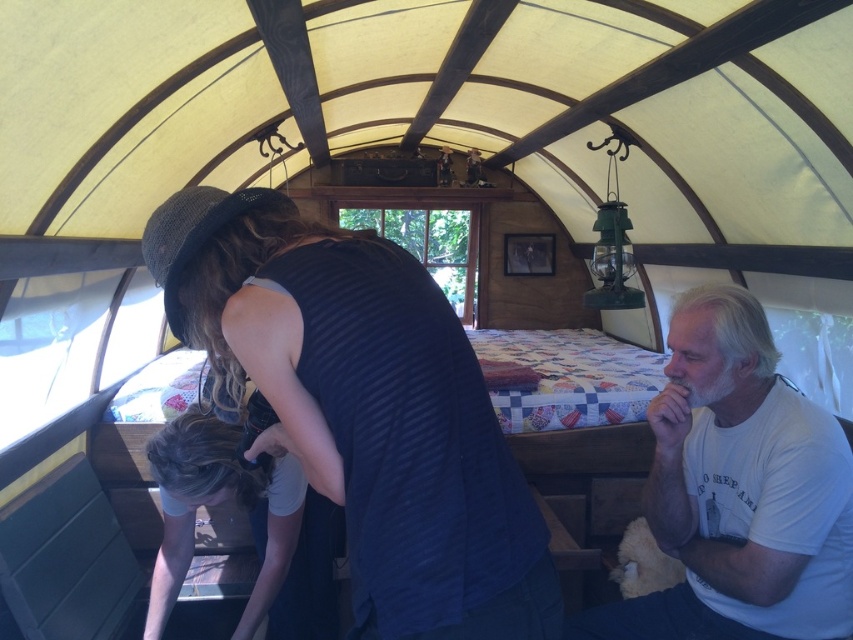
Question: Is dark blue ribbed tank top at center to the left of dark blue fabric at center from the viewer's perspective?

Choices:
 (A) no
 (B) yes

Answer: (A)

Question: Which of the following is the farthest from the observer?

Choices:
 (A) (161, 250)
 (B) (701, 412)

Answer: (B)

Question: Does white cotton t-shirt at right have a lesser width compared to dark blue fabric at center?

Choices:
 (A) no
 (B) yes

Answer: (A)

Question: Does dark blue ribbed tank top at center lie behind dark blue fabric at center?

Choices:
 (A) no
 (B) yes

Answer: (A)

Question: Which object is farther from the camera taking this photo?

Choices:
 (A) white cotton t-shirt at right
 (B) dark blue fabric at center

Answer: (A)

Question: Which point is closer to the camera?

Choices:
 (A) dark blue ribbed tank top at center
 (B) dark blue fabric at center
 (C) white cotton t-shirt at right

Answer: (A)